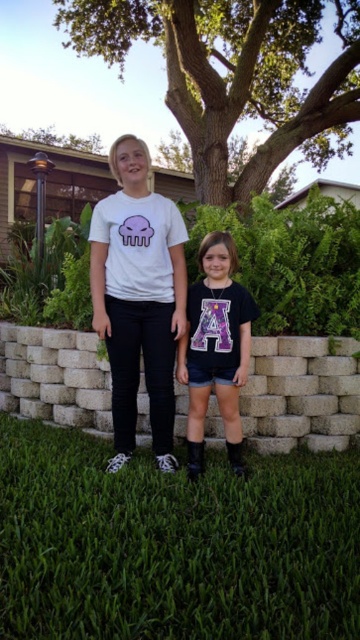
Does green grass at center come behind green leafy tree at upper center?

That is False.

Does green grass at center appear on the left side of green leafy tree at upper center?

Yes, green grass at center is to the left of green leafy tree at upper center.

The width and height of the screenshot is (360, 640). What do you see at coordinates (173, 545) in the screenshot?
I see `green grass at center` at bounding box center [173, 545].

Where is `green grass at center`? green grass at center is located at coordinates (173, 545).

Is green grass at center smaller than white matte t-shirt at center?

Actually, green grass at center might be larger than white matte t-shirt at center.

Does green grass at center have a greater height compared to white matte t-shirt at center?

In fact, green grass at center may be shorter than white matte t-shirt at center.

What do you see at coordinates (173, 545) in the screenshot? This screenshot has width=360, height=640. I see `green grass at center` at bounding box center [173, 545].

Locate an element on the screen. The height and width of the screenshot is (640, 360). green grass at center is located at coordinates (173, 545).

Between point (348, 115) and point (113, 253), which one is positioned in front?

Positioned in front is point (113, 253).

Is point (144, 28) in front of point (137, 284)?

No.

This screenshot has height=640, width=360. In order to click on green leafy tree at upper center in this screenshot , I will do `click(234, 76)`.